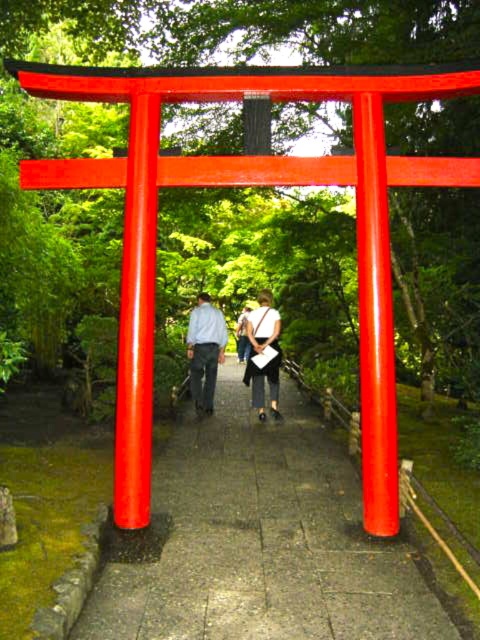
Question: Does light blue shirt at center appear on the left side of matte white bag at center?

Choices:
 (A) yes
 (B) no

Answer: (A)

Question: Which object is closer to the camera taking this photo?

Choices:
 (A) matte blue shirt at center
 (B) light blue shirt at center
 (C) smooth stone path at center

Answer: (C)

Question: Is smooth stone path at center wider than matte white bag at center?

Choices:
 (A) yes
 (B) no

Answer: (A)

Question: Which point is closer to the camera?

Choices:
 (A) (208, 384)
 (B) (273, 371)
 (C) (220, 474)

Answer: (C)

Question: Which object is positioned farthest from the smooth stone path at center?

Choices:
 (A) matte blue shirt at center
 (B) light blue shirt at center

Answer: (B)

Question: Does smooth stone path at center appear on the right side of light blue shirt at center?

Choices:
 (A) yes
 (B) no

Answer: (A)